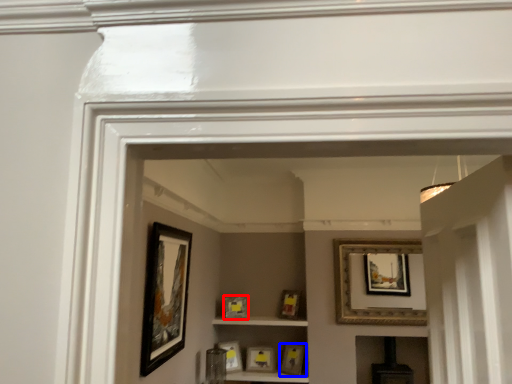
Question: Which object appears closest to the camera in this image, picture frame (highlighted by a red box) or picture frame (highlighted by a blue box)?

Choices:
 (A) picture frame
 (B) picture frame

Answer: (B)